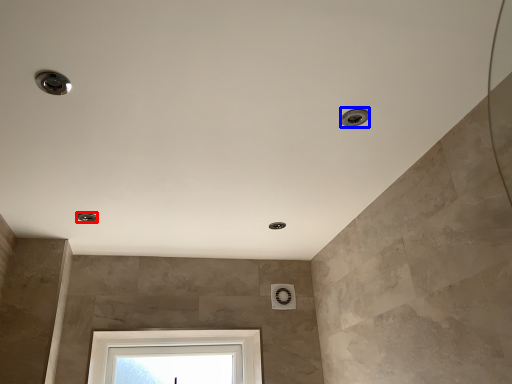
Question: Which object is further to the camera taking this photo, droplight (highlighted by a red box) or droplight (highlighted by a blue box)?

Choices:
 (A) droplight
 (B) droplight

Answer: (A)